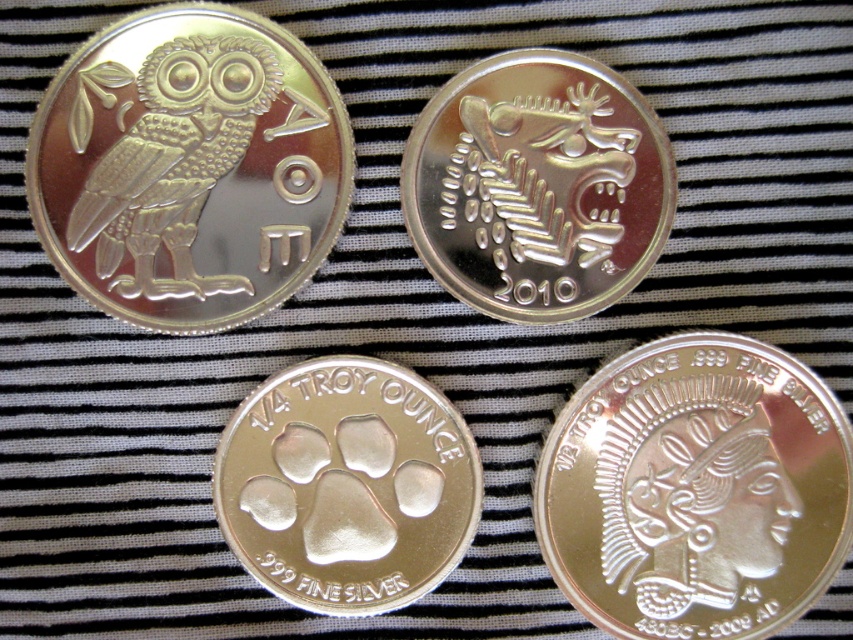
Can you confirm if silver/smooth/reindeer at center is positioned to the left of shiny silver paw print at center?

No, silver/smooth/reindeer at center is not to the left of shiny silver paw print at center.

Who is shorter, silver/smooth/reindeer at center or shiny silver paw print at center?

shiny silver paw print at center is shorter.

Describe the element at coordinates (537, 186) in the screenshot. The width and height of the screenshot is (853, 640). I see `silver/smooth/reindeer at center` at that location.

Identify the location of silver/smooth/reindeer at center. (537, 186).

Looking at this image, can you confirm if polished silver coin at center is wider than silver/smooth/reindeer at center?

Yes.

Who is more distant from viewer, (585, 461) or (561, 289)?

Positioned behind is point (561, 289).

Does point (727, 342) lie behind point (602, 68)?

Yes, point (727, 342) is behind point (602, 68).

Locate an element on the screen. The image size is (853, 640). polished silver coin at center is located at coordinates (695, 490).

Does polished silver coin at center have a greater width compared to shiny silver paw print at center?

Indeed, polished silver coin at center has a greater width compared to shiny silver paw print at center.

Between polished silver coin at center and shiny silver paw print at center, which one has less height?

With less height is shiny silver paw print at center.

Between point (788, 440) and point (378, 376), which one is positioned behind?

The point (378, 376) is more distant.

This screenshot has width=853, height=640. I want to click on polished silver coin at center, so click(x=695, y=490).